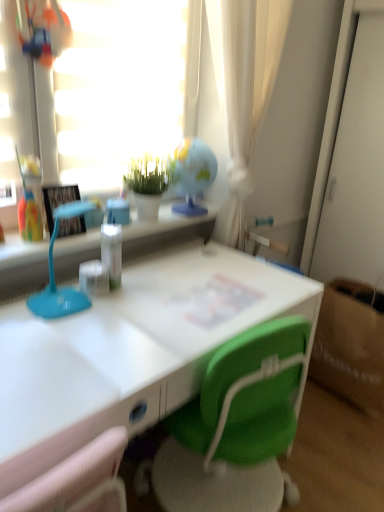
Locate an element on the screen. The image size is (384, 512). free space to the left of clear plastic bottle at center is located at coordinates (61, 293).